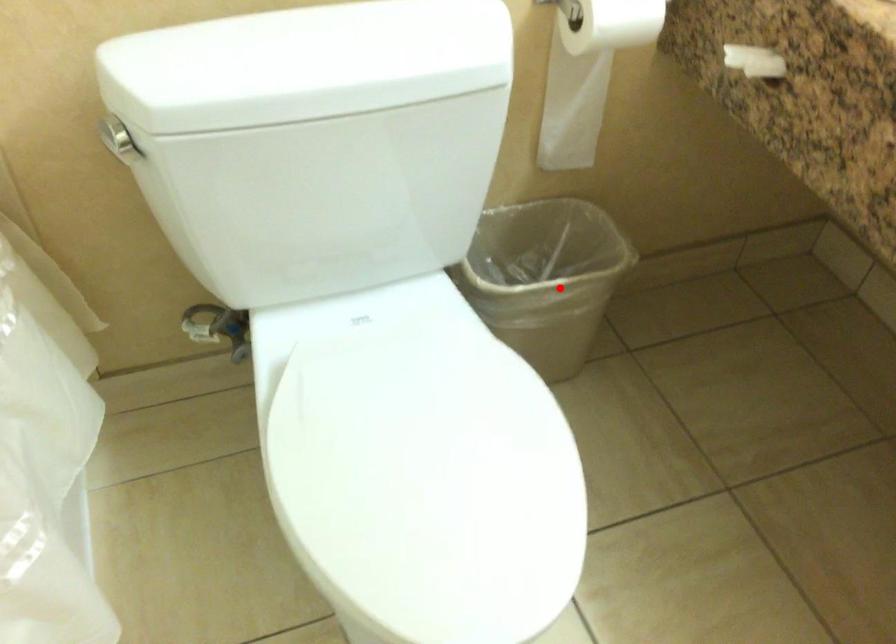
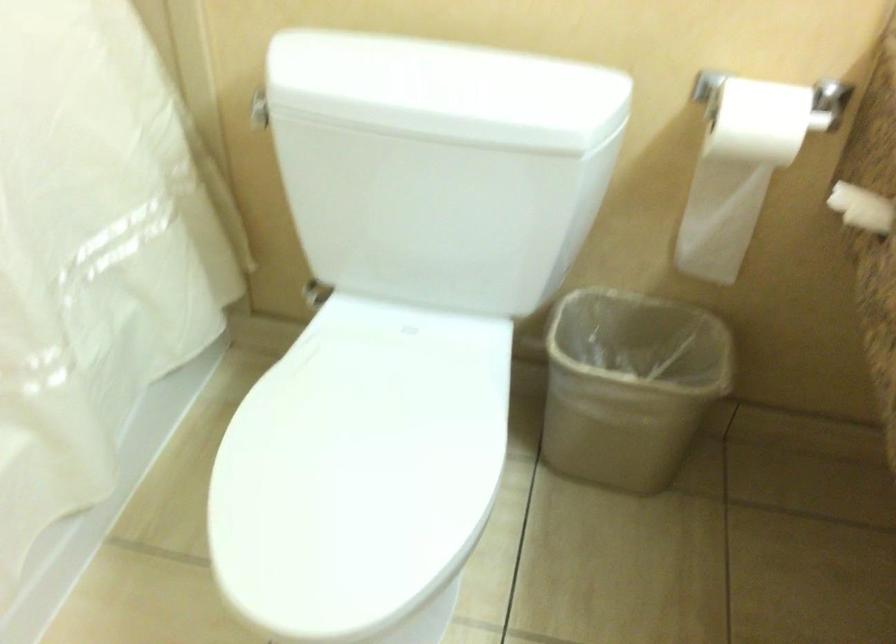
Question: I am providing you with two images of the same scene from different viewpoints. A red point is marked on the first image. Is the red point's position out of view in image 2?

Choices:
 (A) Yes
 (B) No

Answer: (B)